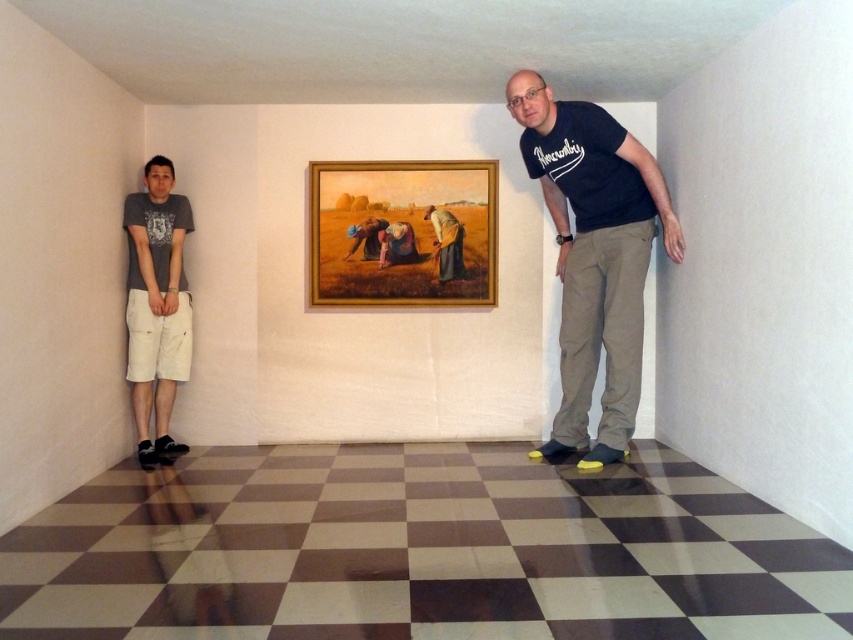
Does wooden frame at center have a larger size compared to brown textured fabric at center?

Yes, wooden frame at center is bigger than brown textured fabric at center.

Between point (312, 250) and point (445, 259), which one is positioned behind?

Positioned behind is point (445, 259).

At what (x,y) coordinates should I click in order to perform the action: click on wooden frame at center. Please return your answer as a coordinate pair (x, y). Looking at the image, I should click on (403, 234).

Does black cotton t-shirt at right have a greater height compared to brown textured fabric at center?

Yes.

Is black cotton t-shirt at right to the right of brown textured fabric at center from the viewer's perspective?

Yes, black cotton t-shirt at right is to the right of brown textured fabric at center.

Locate an element on the screen. Image resolution: width=853 pixels, height=640 pixels. black cotton t-shirt at right is located at coordinates (595, 256).

Can you confirm if black cotton t-shirt at right is wider than matte gray t-shirt at left?

Yes, black cotton t-shirt at right is wider than matte gray t-shirt at left.

Is black cotton t-shirt at right to the right of matte gray t-shirt at left from the viewer's perspective?

Yes, black cotton t-shirt at right is to the right of matte gray t-shirt at left.

Identify the location of black cotton t-shirt at right. This screenshot has height=640, width=853. (595, 256).